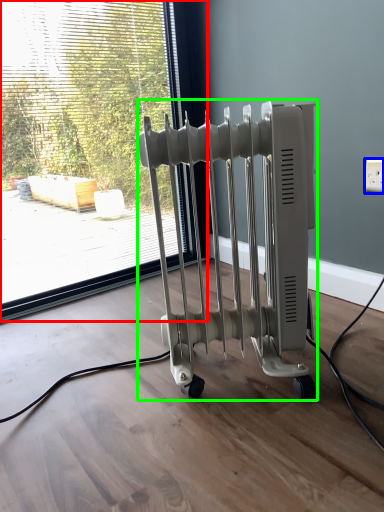
Question: Which object is the farthest from window (highlighted by a red box)? Choose among these: electric outlet (highlighted by a blue box) or bath heater (highlighted by a green box).

Choices:
 (A) electric outlet
 (B) bath heater

Answer: (A)